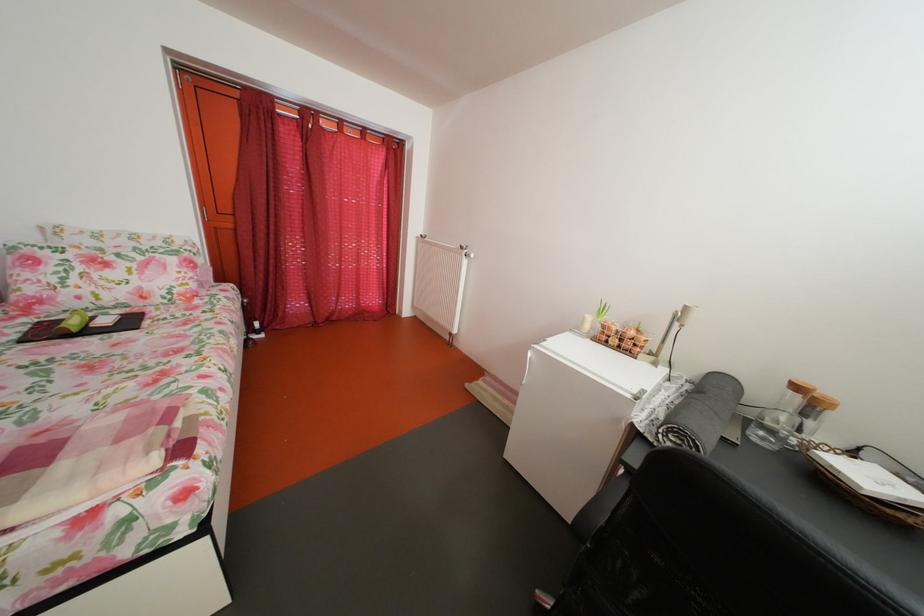
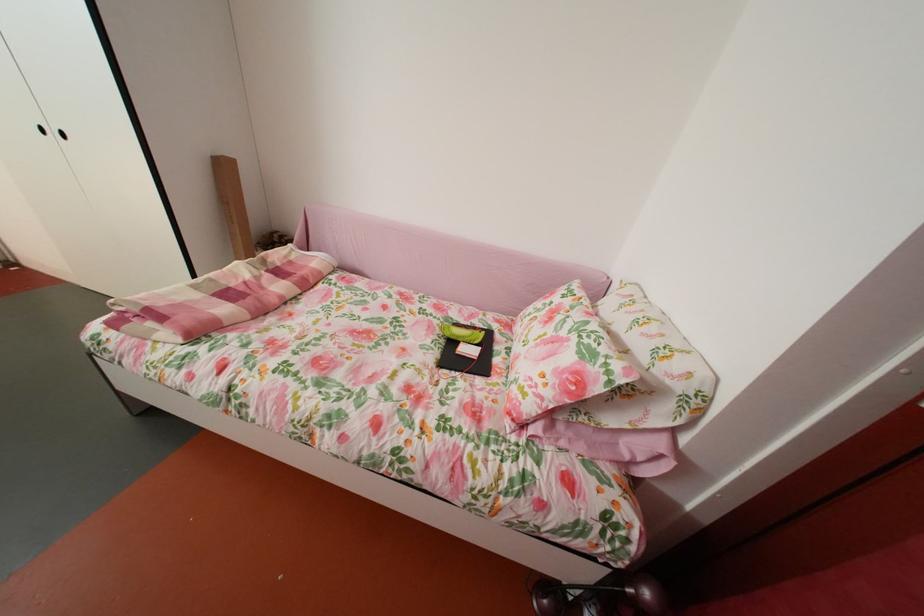
In the second image, find the point that corresponds to (205,292) in the first image.

(541, 413)